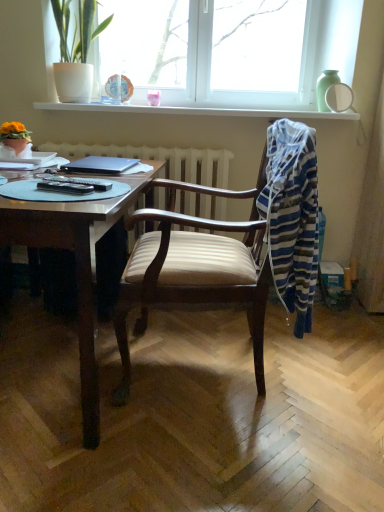
You are a GUI agent. You are given a task and a screenshot of the screen. Output one action in this format:
    pyautogui.click(x=<x>, y=<y>)
    Task: Click on the vacant space underneath wooden desk at left (from a real-world perspective)
    
    Given the screenshot: What is the action you would take?
    pyautogui.click(x=47, y=366)